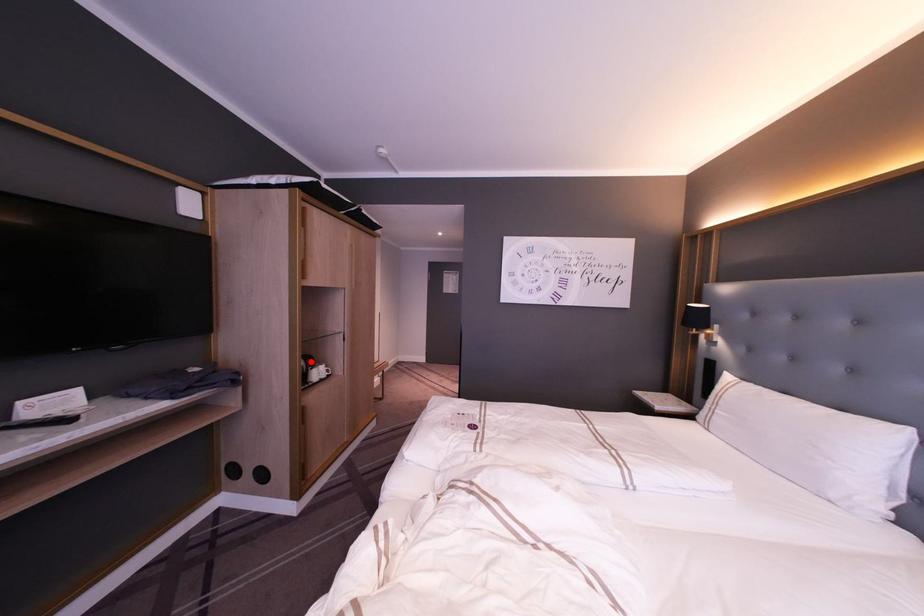
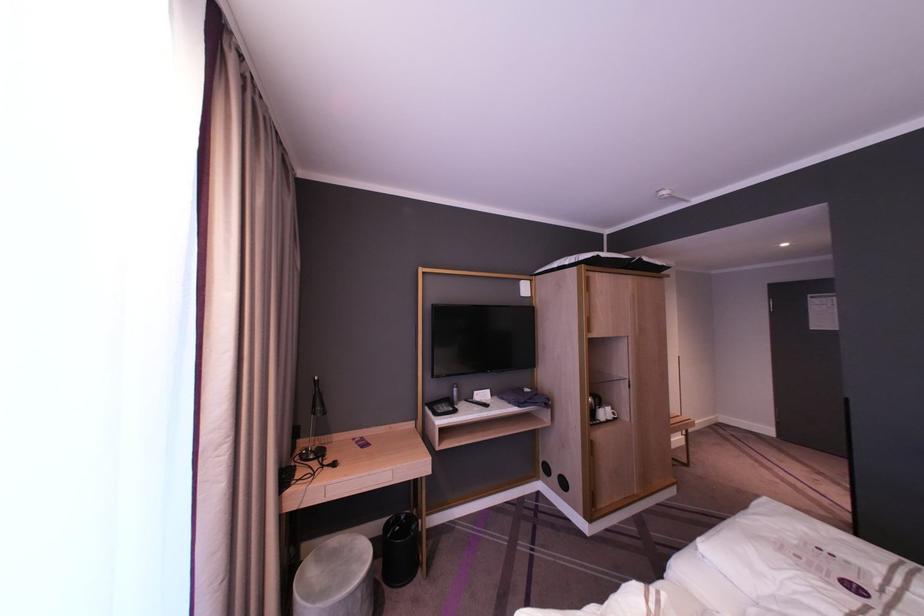
Question: I am providing you with two images of the same scene from different viewpoints. A red point is shown in image1. For the corresponding object point in image2, is it positioned nearer or farther from the camera?

Choices:
 (A) Nearer
 (B) Farther

Answer: (B)